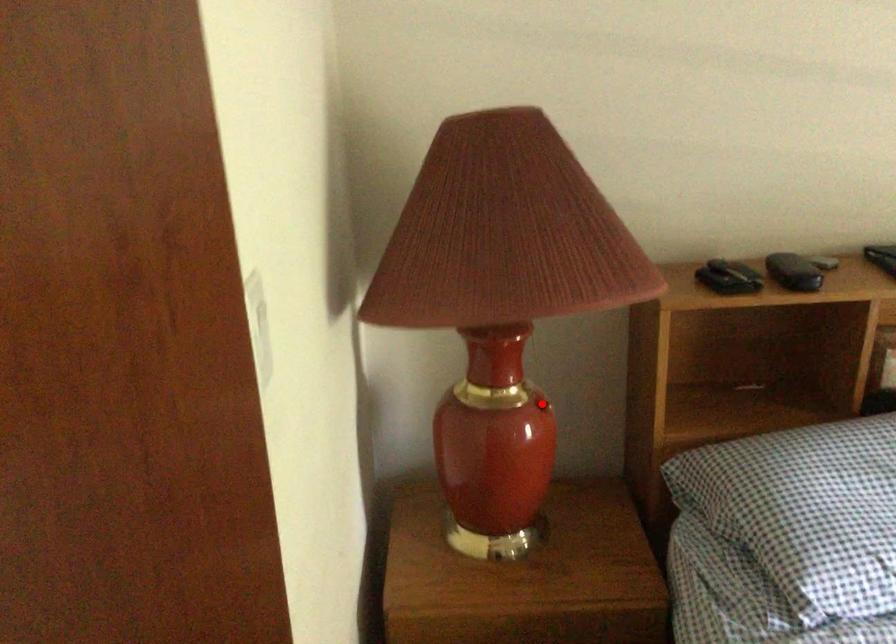
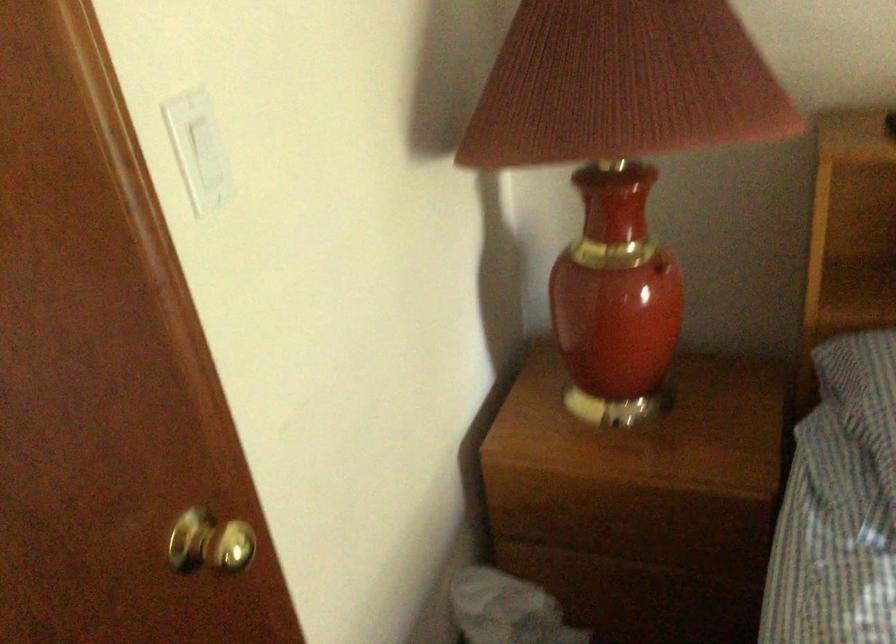
Question: I am providing you with two images of the same scene from different viewpoints. Given a red point in image1, look at the same physical point in image2. Is it:

Choices:
 (A) Closer to the viewpoint
 (B) Farther from the viewpoint

Answer: (A)